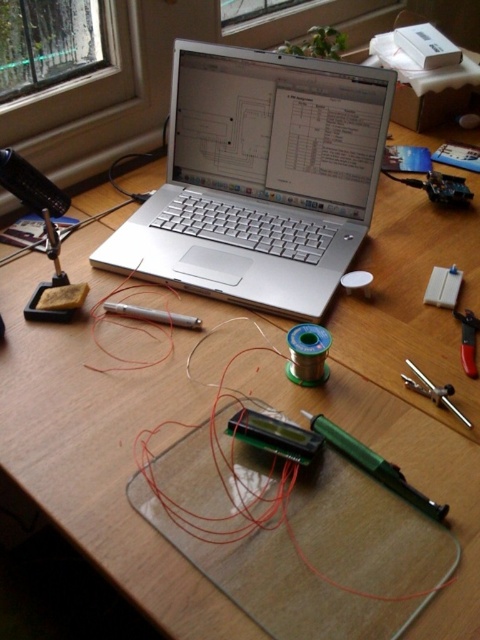
Question: Which point is farther to the camera?

Choices:
 (A) metallic silver compass at right
 (B) silver metallic laptop at center

Answer: (B)

Question: Does silver metallic laptop at center have a lesser width compared to metallic silver compass at right?

Choices:
 (A) yes
 (B) no

Answer: (B)

Question: Is silver metallic laptop at center positioned in front of metallic silver compass at right?

Choices:
 (A) yes
 (B) no

Answer: (B)

Question: In this image, where is silver metallic laptop at center located relative to metallic silver compass at right?

Choices:
 (A) left
 (B) right

Answer: (A)

Question: Which point is closer to the camera taking this photo?

Choices:
 (A) (252, 189)
 (B) (444, 397)

Answer: (B)